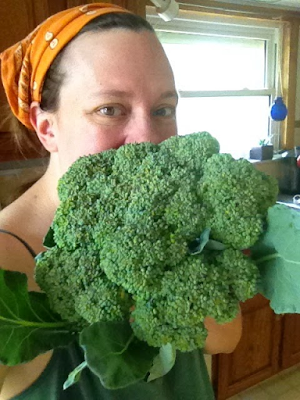
Where is `the left cabinet`? the left cabinet is located at coordinates (259, 355).